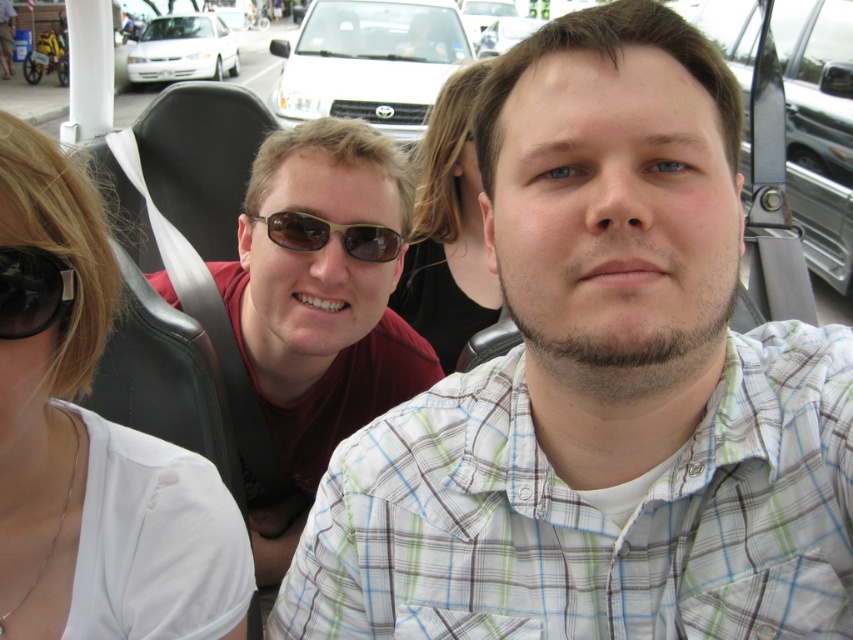
Question: Based on their relative distances, which object is farther from the white glossy sedan at upper left?

Choices:
 (A) white fabric shirt at left
 (B) sunglasses at center

Answer: (A)

Question: Is the position of white glossy sedan at upper left more distant than that of sunglasses at center?

Choices:
 (A) yes
 (B) no

Answer: (A)

Question: Is white fabric shirt at left to the right of black plastic goggles at upper left from the viewer's perspective?

Choices:
 (A) yes
 (B) no

Answer: (B)

Question: Which object appears closest to the camera in this image?

Choices:
 (A) matte black shirt at center
 (B) white matte car at upper center

Answer: (A)

Question: Is white glossy sedan at upper left positioned in front of sunglasses at center?

Choices:
 (A) no
 (B) yes

Answer: (A)

Question: Estimate the real-world distances between objects in this image. Which object is closer to the white matte car at upper center?

Choices:
 (A) black plastic goggles at upper left
 (B) white glossy sedan at upper left
 (C) sunglasses at center

Answer: (C)